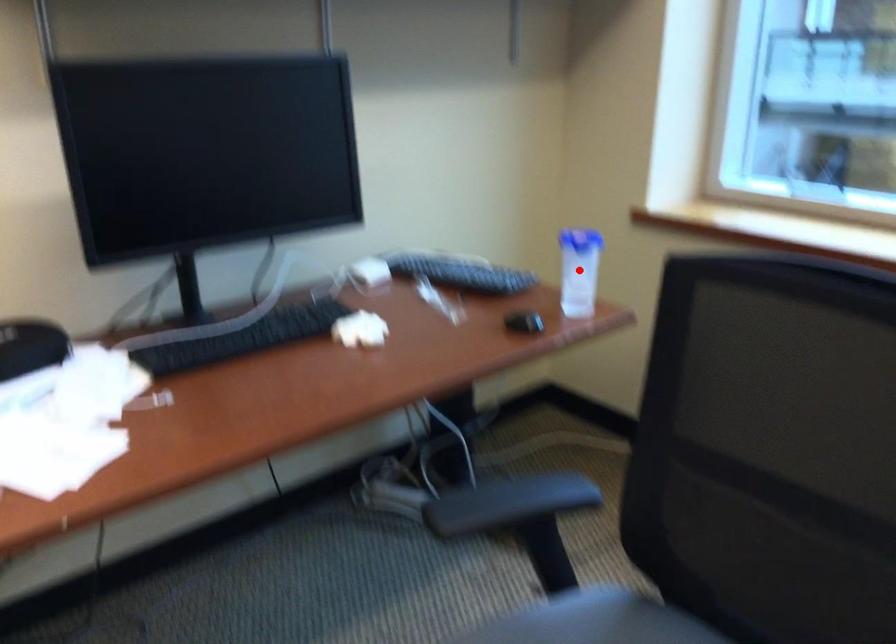
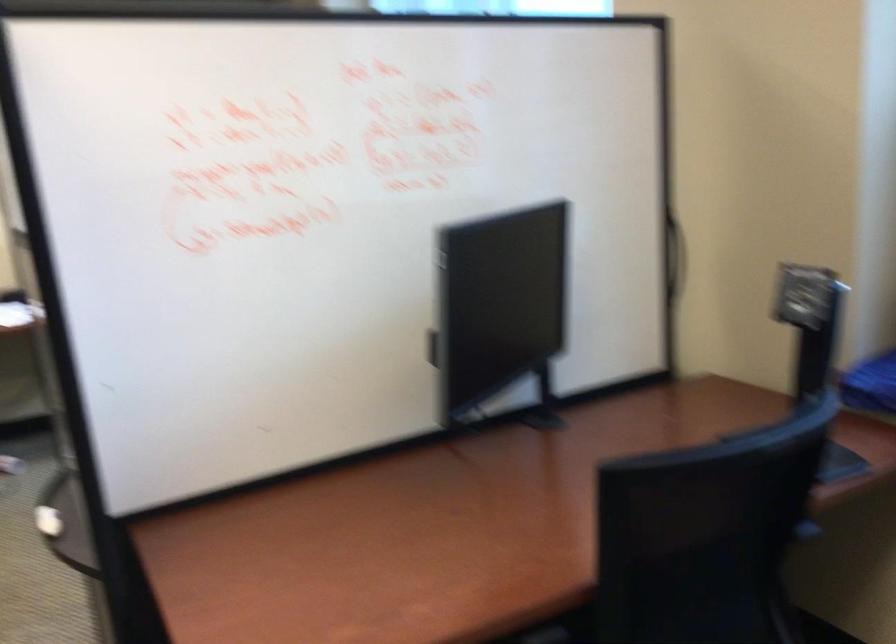
Question: I am providing you with two images of the same scene from different viewpoints. A red point is marked on the first image. Can you still see the location of the red point in image 2?

Choices:
 (A) Yes
 (B) No

Answer: (B)